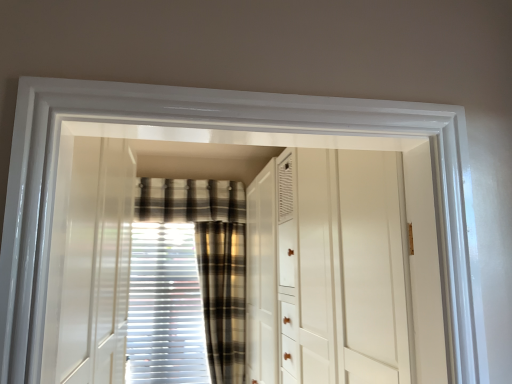
Find the location of a particular element. The width and height of the screenshot is (512, 384). vacant area on top of plaid fabric at center (from a real-world perspective) is located at coordinates (194, 188).